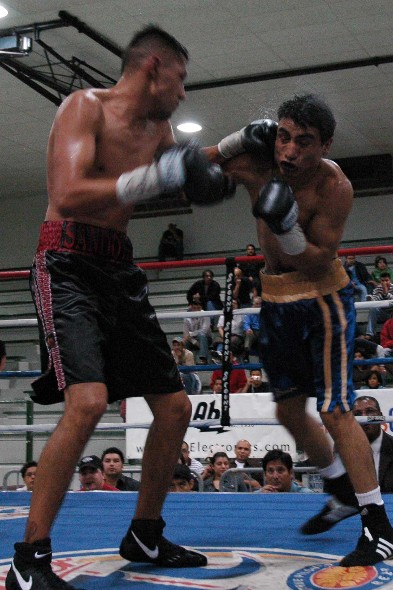
This screenshot has width=393, height=590. Identify the location of wall. (22, 235), (222, 224), (373, 209).